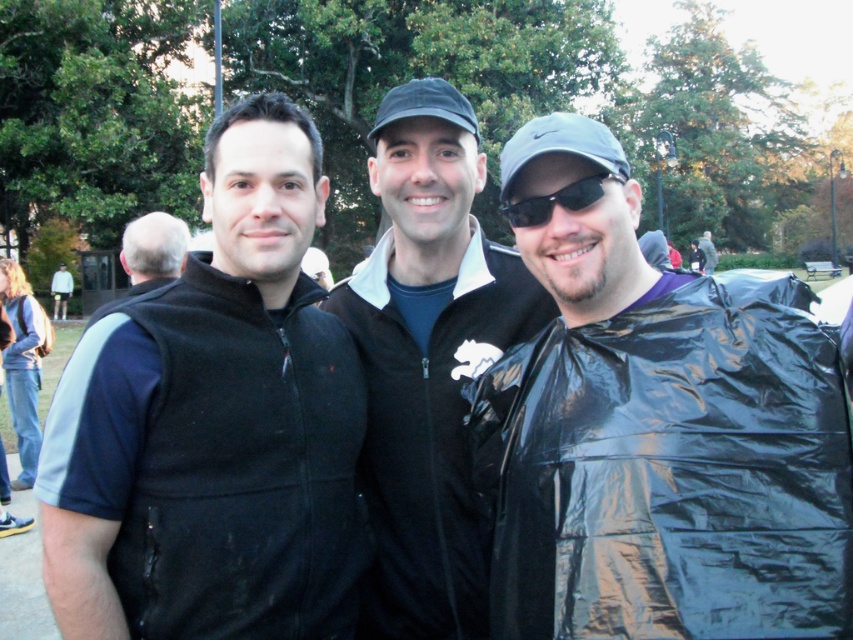
Who is more forward, (415, 321) or (138, 234)?

Point (415, 321)

Is black matte jacket at center bigger than gray hair at left?

Actually, black matte jacket at center might be smaller than gray hair at left.

Is point (445, 268) positioned in front of point (148, 212)?

Yes.

Identify the location of black matte jacket at center. (428, 362).

Is glossy plastic bag at right below black fleece vest at center?

Indeed, glossy plastic bag at right is positioned under black fleece vest at center.

Who is positioned more to the right, glossy plastic bag at right or black fleece vest at center?

From the viewer's perspective, glossy plastic bag at right appears more on the right side.

Measure the distance between point (746, 554) and camera.

Point (746, 554) is 1.57 meters away from camera.

Identify the location of glossy plastic bag at right. The width and height of the screenshot is (853, 640). (657, 433).

Is point (471, 236) positioned after point (65, 285)?

That is False.

Is black matte jacket at center to the left of light gray hoodie at upper left from the viewer's perspective?

Incorrect, black matte jacket at center is not on the left side of light gray hoodie at upper left.

Does point (424, 544) come behind point (53, 275)?

No, (424, 544) is closer to viewer.

At what (x,y) coordinates should I click in order to perform the action: click on black matte jacket at center. Please return your answer as a coordinate pair (x, y). Looking at the image, I should click on (428, 362).